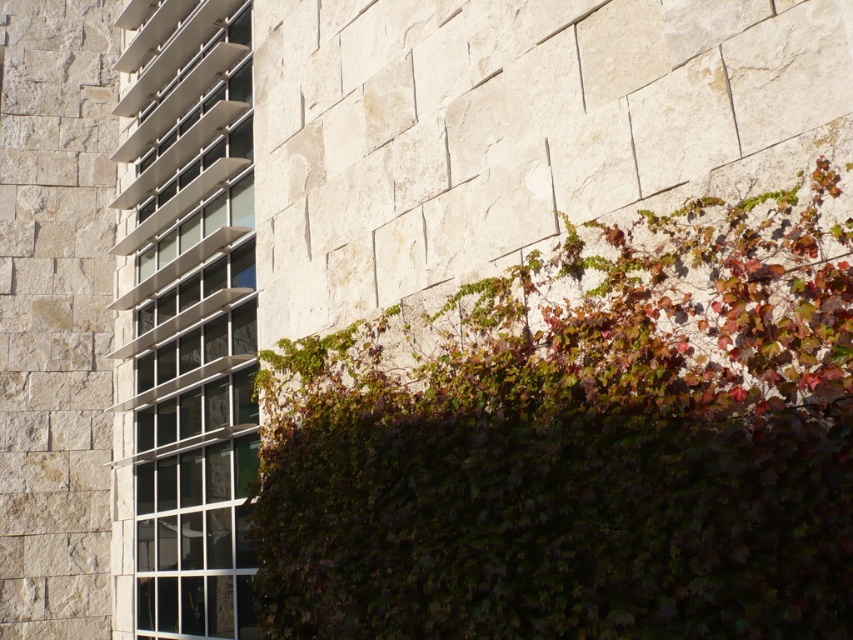
Question: Which object appears farthest from the camera in this image?

Choices:
 (A) metallic glass window at left
 (B) green leafy hedge at upper right

Answer: (A)

Question: Is green leafy hedge at upper right behind metallic glass window at left?

Choices:
 (A) no
 (B) yes

Answer: (A)

Question: Which object is farther from the camera taking this photo?

Choices:
 (A) green leafy hedge at upper right
 (B) metallic glass window at left

Answer: (B)

Question: From the image, what is the correct spatial relationship of green leafy hedge at upper right in relation to metallic glass window at left?

Choices:
 (A) above
 (B) below

Answer: (B)

Question: Can you confirm if green leafy hedge at upper right is wider than metallic glass window at left?

Choices:
 (A) no
 (B) yes

Answer: (B)